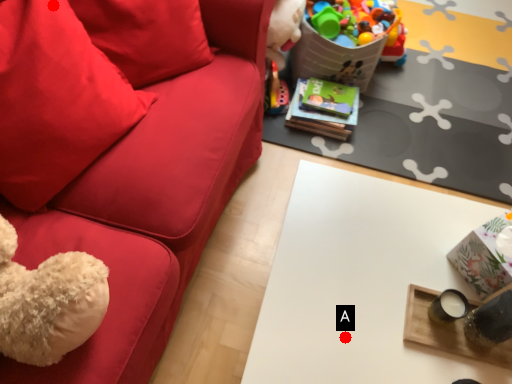
Question: Two points are circled on the image, labeled by A and B beside each circle. Which of the following is the closest to the observer?

Choices:
 (A) A is closer
 (B) B is closer

Answer: (A)